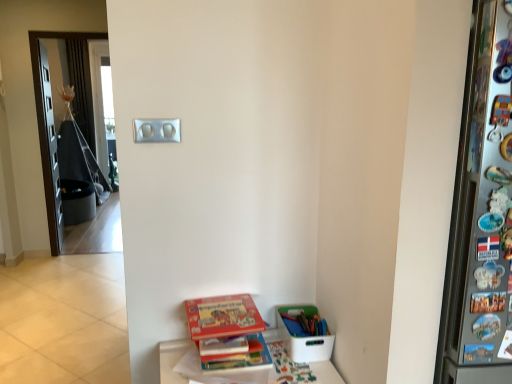
I want to click on hardcover book at lower center, which ranks as the 1th book in top-to-bottom order, so click(228, 333).

What do you see at coordinates (228, 333) in the screenshot?
I see `hardcover book at lower center, which ranks as the 1th book in top-to-bottom order` at bounding box center [228, 333].

Measure the distance between stacked books at lower right and camera.

stacked books at lower right and camera are 1.44 meters apart from each other.

The image size is (512, 384). I want to click on white plastic container at lower right, so click(303, 337).

Locate an element on the screen. The width and height of the screenshot is (512, 384). hardcover book at lower center, marked as the second book in a top-to-bottom arrangement is located at coordinates (241, 357).

From the picture: Which of these two, white plastic container at lower right or stacked books at lower right, stands taller?

stacked books at lower right is taller.

Would you say white plastic container at lower right is a long distance from stacked books at lower right?

No, white plastic container at lower right is not far away from stacked books at lower right.

From the picture: Is white plastic container at lower right situated inside stacked books at lower right or outside?

white plastic container at lower right is outside stacked books at lower right.

From a real-world perspective, which is physically above, white plastic container at lower right or stacked books at lower right?

From a 3D spatial view, white plastic container at lower right is above.

From the picture: Visually, is hardcover book at lower center, marked as the second book in a top-to-bottom arrangement, positioned to the left or to the right of stacked books at lower right?

In the image, hardcover book at lower center, marked as the second book in a top-to-bottom arrangement, appears on the left side of stacked books at lower right.

From the image's perspective, is hardcover book at lower center, the 1th book positioned from the bottom, on stacked books at lower right?

Yes, from the image's perspective, hardcover book at lower center, the 1th book positioned from the bottom, is on top of stacked books at lower right.

Which is behind, point (223, 357) or point (172, 343)?

Positioned behind is point (172, 343).

Would you consider hardcover book at lower center, the 1th book positioned from the bottom, to be distant from stacked books at lower right?

Actually, hardcover book at lower center, the 1th book positioned from the bottom, and stacked books at lower right are a little close together.

In the scene shown: Could you tell me if silver metallic light switch at upper center is turned towards hardcover book at lower center, acting as the 2th book starting from the bottom?

No, silver metallic light switch at upper center is not facing towards hardcover book at lower center, acting as the 2th book starting from the bottom.

From the image's perspective, which one is positioned higher, silver metallic light switch at upper center or hardcover book at lower center, which ranks as the 1th book in top-to-bottom order?

silver metallic light switch at upper center, from the image's perspective.

Based on the photo, is silver metallic light switch at upper center next to hardcover book at lower center, which ranks as the 1th book in top-to-bottom order, and touching it?

No, silver metallic light switch at upper center is not next to hardcover book at lower center, which ranks as the 1th book in top-to-bottom order.

Who is taller, silver metallic light switch at upper center or hardcover book at lower center, acting as the 2th book starting from the bottom?

silver metallic light switch at upper center.

From the image's perspective, is stacked books at lower right above hardcover book at lower center, which ranks as the 1th book in top-to-bottom order?

Actually, stacked books at lower right appears below hardcover book at lower center, which ranks as the 1th book in top-to-bottom order, in the image.

Who is taller, stacked books at lower right or hardcover book at lower center, which ranks as the 1th book in top-to-bottom order?

stacked books at lower right is taller.

Considering the sizes of objects stacked books at lower right and hardcover book at lower center, which ranks as the 1th book in top-to-bottom order, in the image provided, who is smaller, stacked books at lower right or hardcover book at lower center, which ranks as the 1th book in top-to-bottom order,?

Smaller between the two is hardcover book at lower center, which ranks as the 1th book in top-to-bottom order.

From a real-world perspective, is white plastic container at lower right positioned above or below hardcover book at lower center, which ranks as the 1th book in top-to-bottom order?

white plastic container at lower right is below hardcover book at lower center, which ranks as the 1th book in top-to-bottom order.

Considering the positions of objects white plastic container at lower right and hardcover book at lower center, acting as the 2th book starting from the bottom, in the image provided, who is in front, white plastic container at lower right or hardcover book at lower center, acting as the 2th book starting from the bottom,?

hardcover book at lower center, acting as the 2th book starting from the bottom, is in front.

Considering the sizes of objects white plastic container at lower right and hardcover book at lower center, which ranks as the 1th book in top-to-bottom order, in the image provided, who is bigger, white plastic container at lower right or hardcover book at lower center, which ranks as the 1th book in top-to-bottom order,?

With larger size is white plastic container at lower right.

Which is correct: silver metallic light switch at upper center is inside stacked books at lower right, or outside of it?

silver metallic light switch at upper center cannot be found inside stacked books at lower right.

Which object is positioned more to the right, silver metallic light switch at upper center or stacked books at lower right?

stacked books at lower right.

From a real-world perspective, is silver metallic light switch at upper center on stacked books at lower right?

Correct, in the physical world, silver metallic light switch at upper center is higher than stacked books at lower right.

Is silver metallic light switch at upper center oriented away from stacked books at lower right?

No, silver metallic light switch at upper center is not facing the opposite direction of stacked books at lower right.

From the image's perspective, which is above, stacked books at lower right or white plastic container at lower right?

white plastic container at lower right, from the image's perspective.

Considering the sizes of stacked books at lower right and white plastic container at lower right in the image, is stacked books at lower right taller or shorter than white plastic container at lower right?

In the image, stacked books at lower right appears to be taller than white plastic container at lower right.

Can we say stacked books at lower right lies outside white plastic container at lower right?

That's correct, stacked books at lower right is outside of white plastic container at lower right.

Considering the sizes of objects stacked books at lower right and white plastic container at lower right in the image provided, who is thinner, stacked books at lower right or white plastic container at lower right?

white plastic container at lower right is thinner.

Find the location of a particular element. This screenshot has height=384, width=512. box above the stacked books at lower right (from the image's perspective) is located at coordinates tap(303, 337).

Identify the location of furniture that is under the hardcover book at lower center, marked as the second book in a top-to-bottom arrangement (from a real-world perspective). Image resolution: width=512 pixels, height=384 pixels. (172, 360).

From the picture: Looking at the image, which one is located further to stacked books at lower right, hardcover book at lower center, the 1th book positioned from the bottom, or hardcover book at lower center, which ranks as the 1th book in top-to-bottom order?

The object further to stacked books at lower right is hardcover book at lower center, which ranks as the 1th book in top-to-bottom order.

Looking at the image, which one is located closer to silver metallic light switch at upper center, white plastic container at lower right or hardcover book at lower center, the 1th book positioned from the bottom?

hardcover book at lower center, the 1th book positioned from the bottom, lies closer to silver metallic light switch at upper center than the other object.

When comparing their distances from white plastic container at lower right, does hardcover book at lower center, the 1th book positioned from the bottom, or hardcover book at lower center, which ranks as the 1th book in top-to-bottom order, seem further?

Based on the image, hardcover book at lower center, which ranks as the 1th book in top-to-bottom order, appears to be further to white plastic container at lower right.

Looking at the image, which one is located further to hardcover book at lower center, acting as the 2th book starting from the bottom, stacked books at lower right or hardcover book at lower center, marked as the second book in a top-to-bottom arrangement?

stacked books at lower right lies further to hardcover book at lower center, acting as the 2th book starting from the bottom, than the other object.

From the image, which object appears to be farther from hardcover book at lower center, the 1th book positioned from the bottom, hardcover book at lower center, acting as the 2th book starting from the bottom, or white plastic container at lower right?

white plastic container at lower right lies further to hardcover book at lower center, the 1th book positioned from the bottom, than the other object.

Which object lies nearer to the anchor point white plastic container at lower right, silver metallic light switch at upper center or hardcover book at lower center, acting as the 2th book starting from the bottom?

Among the two, hardcover book at lower center, acting as the 2th book starting from the bottom, is located nearer to white plastic container at lower right.

When comparing their distances from white plastic container at lower right, does stacked books at lower right or silver metallic light switch at upper center seem closer?

stacked books at lower right is positioned closer to the anchor white plastic container at lower right.

Estimate the real-world distances between objects in this image. Which object is closer to hardcover book at lower center, acting as the 2th book starting from the bottom, hardcover book at lower center, marked as the second book in a top-to-bottom arrangement, or silver metallic light switch at upper center?

hardcover book at lower center, marked as the second book in a top-to-bottom arrangement, is closer to hardcover book at lower center, acting as the 2th book starting from the bottom.

You are a GUI agent. You are given a task and a screenshot of the screen. Output one action in this format:
    pyautogui.click(x=<x>, y=<y>)
    Task: Click on the book between silver metallic light switch at upper center and hardcover book at lower center, marked as the second book in a top-to-bottom arrangement, in the vertical direction
    
    Given the screenshot: What is the action you would take?
    pyautogui.click(x=228, y=333)

Locate an element on the screen. The width and height of the screenshot is (512, 384). book located between hardcover book at lower center, acting as the 2th book starting from the bottom, and white plastic container at lower right in the left-right direction is located at coordinates (241, 357).

This screenshot has width=512, height=384. What are the coordinates of `book that lies between hardcover book at lower center, acting as the 2th book starting from the bottom, and stacked books at lower right from top to bottom` in the screenshot? It's located at (241, 357).

Find the location of a particular element. This screenshot has width=512, height=384. furniture between hardcover book at lower center, acting as the 2th book starting from the bottom, and white plastic container at lower right from left to right is located at coordinates (172, 360).